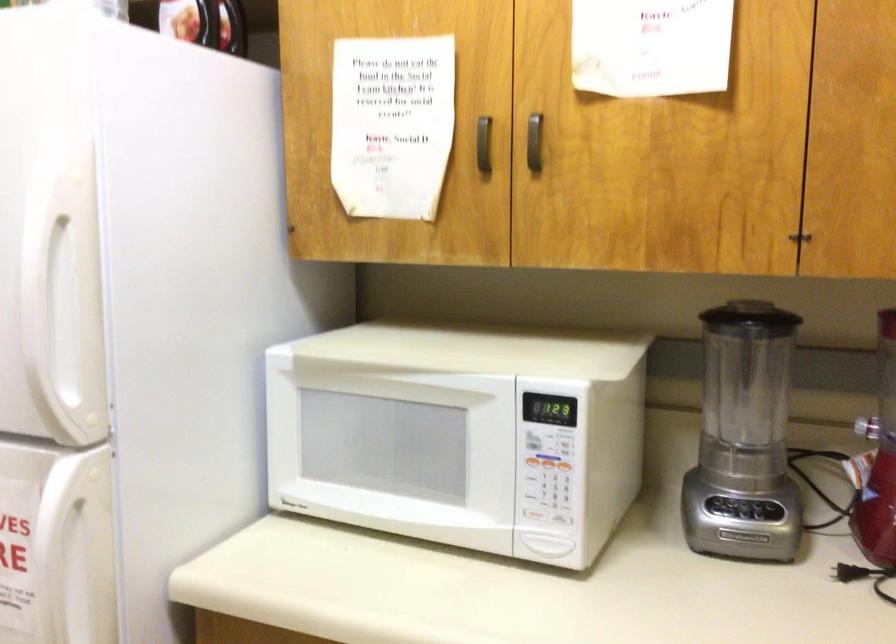
What do you see at coordinates (751, 315) in the screenshot? I see `the black blender lid` at bounding box center [751, 315].